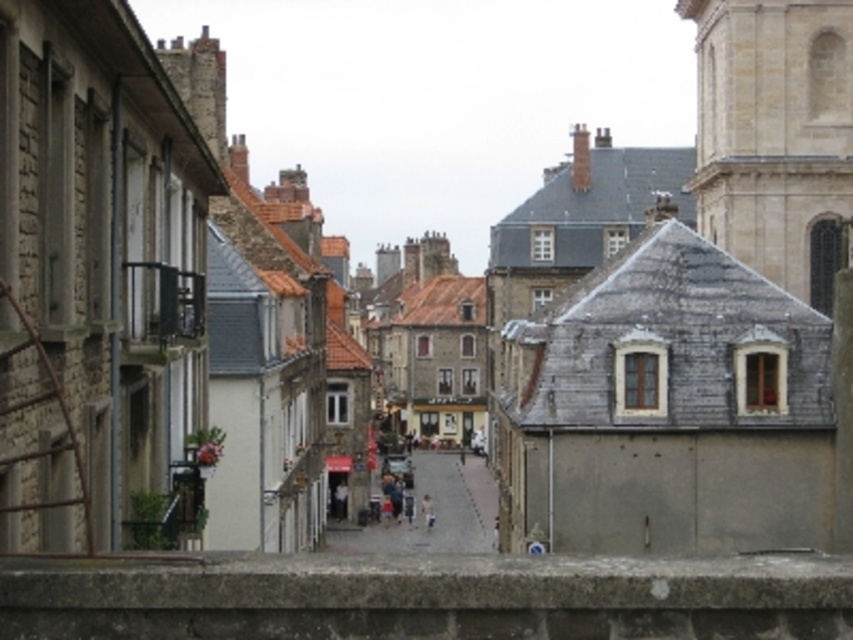
From the picture: You are a tourist standing on the street and want to take a photo of the beige stone tower at upper right. There is a concrete ledge at lower center in your way. Can you move around the ledge to get a clear view of the tower?

A: The concrete ledge at lower center is smaller than beige stone tower at upper right, so you can move around the ledge to get a clear view of the beige stone tower at upper right since the ledge is not blocking the entire area.

You are a tourist standing at the entrance of the street and want to take a photo of the beige stone tower at upper right and the smooth stone alley at center. Which object should you point your camera upwards to capture?

You should point your camera upwards to capture the beige stone tower at upper right because it is located above the smooth stone alley at center.